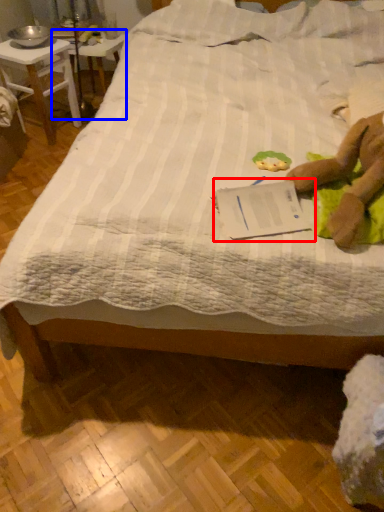
Question: Among these objects, which one is nearest to the camera, paperback book (highlighted by a red box) or table (highlighted by a blue box)?

Choices:
 (A) paperback book
 (B) table

Answer: (A)